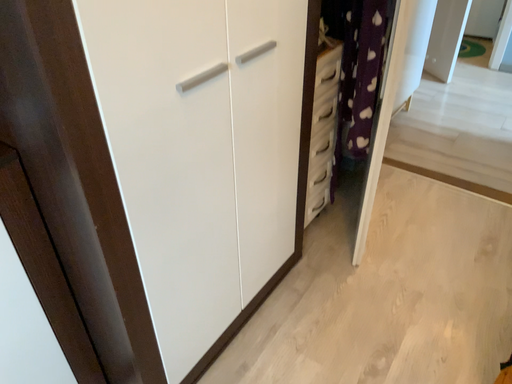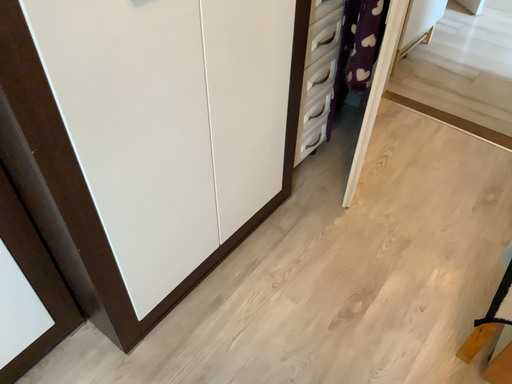
Question: How did the camera likely rotate when shooting the video?

Choices:
 (A) rotated upward
 (B) rotated downward

Answer: (B)